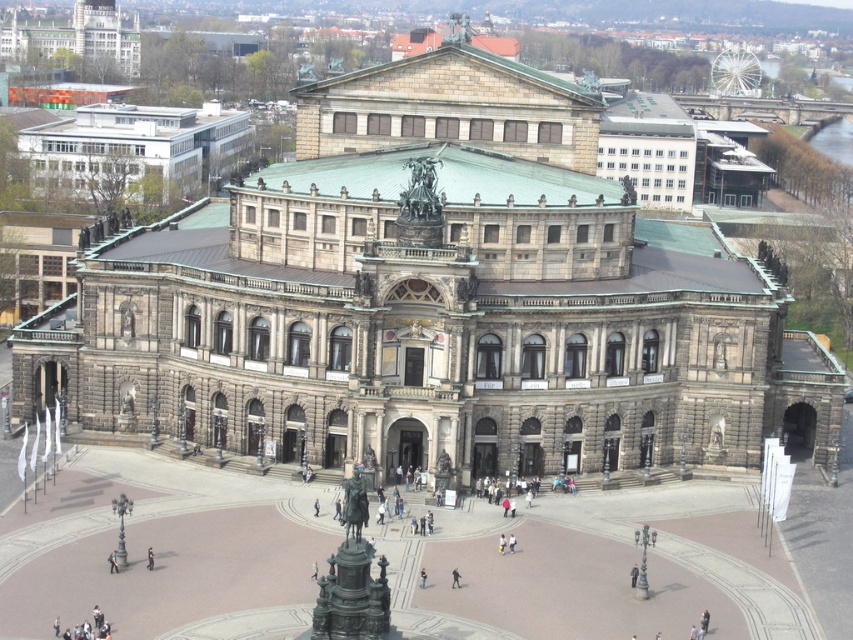
Question: Which point is farther to the camera?

Choices:
 (A) black fabric person at center
 (B) dark gray fabric jacket at center

Answer: (A)

Question: Does dark gray fabric jacket at center come behind black fabric person at center?

Choices:
 (A) yes
 (B) no

Answer: (B)

Question: Is dark gray fabric jacket at center to the left of black fabric person at center from the viewer's perspective?

Choices:
 (A) no
 (B) yes

Answer: (A)

Question: Does dark gray fabric jacket at center lie in front of black fabric person at center?

Choices:
 (A) yes
 (B) no

Answer: (A)

Question: Which point appears closest to the camera in this image?

Choices:
 (A) (149, 566)
 (B) (453, 576)

Answer: (B)